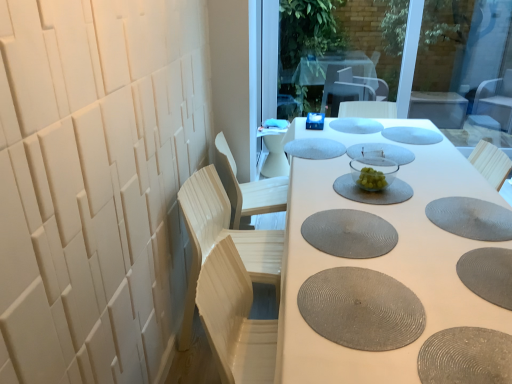
Find the location of a particular element. This screenshot has width=512, height=384. free space to the left of gray rubber mat at center, which appears as the 9th manhole cover when viewed from the front is located at coordinates pyautogui.click(x=356, y=135).